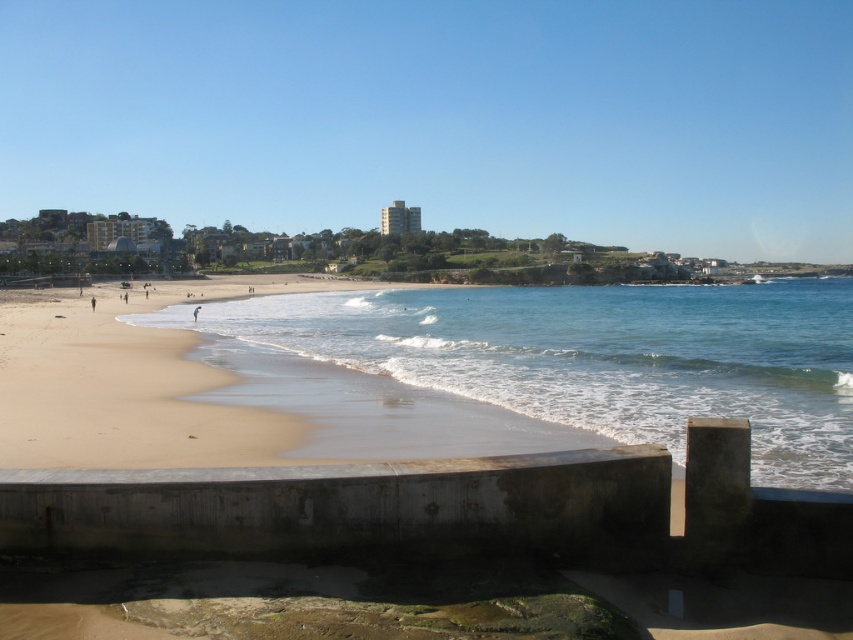
You are a GUI agent. You are given a task and a screenshot of the screen. Output one action in this format:
    pyautogui.click(x=<x>, y=<y>)
    Task: Click on the clear blue water at beach left
    The width and height of the screenshot is (853, 640).
    Given the screenshot: What is the action you would take?
    pyautogui.click(x=548, y=369)

This screenshot has width=853, height=640. I want to click on clear blue water at beach left, so click(x=548, y=369).

Does clear blue water at beach left appear over skinny person at beach center?

Yes, clear blue water at beach left is above skinny person at beach center.

Who is more distant from viewer, [683,429] or [193,320]?

The point [193,320] is behind.

Image resolution: width=853 pixels, height=640 pixels. What do you see at coordinates (548, 369) in the screenshot?
I see `clear blue water at beach left` at bounding box center [548, 369].

At what (x,y) coordinates should I click in order to perform the action: click on clear blue water at beach left. Please return your answer as a coordinate pair (x, y). Looking at the image, I should click on (548, 369).

Is light brown sand at lower left positioned before skinny person at beach center?

Yes.

Does light brown sand at lower left appear on the right side of skinny person at beach center?

Incorrect, light brown sand at lower left is not on the right side of skinny person at beach center.

Locate an element on the screen. The image size is (853, 640). light brown sand at lower left is located at coordinates (119, 394).